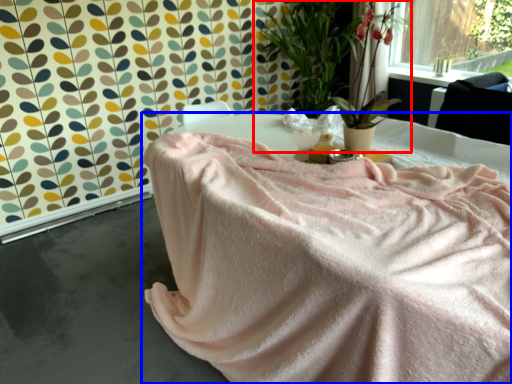
Question: Which object appears farthest to the camera in this image, houseplant (highlighted by a red box) or furniture (highlighted by a blue box)?

Choices:
 (A) houseplant
 (B) furniture

Answer: (A)